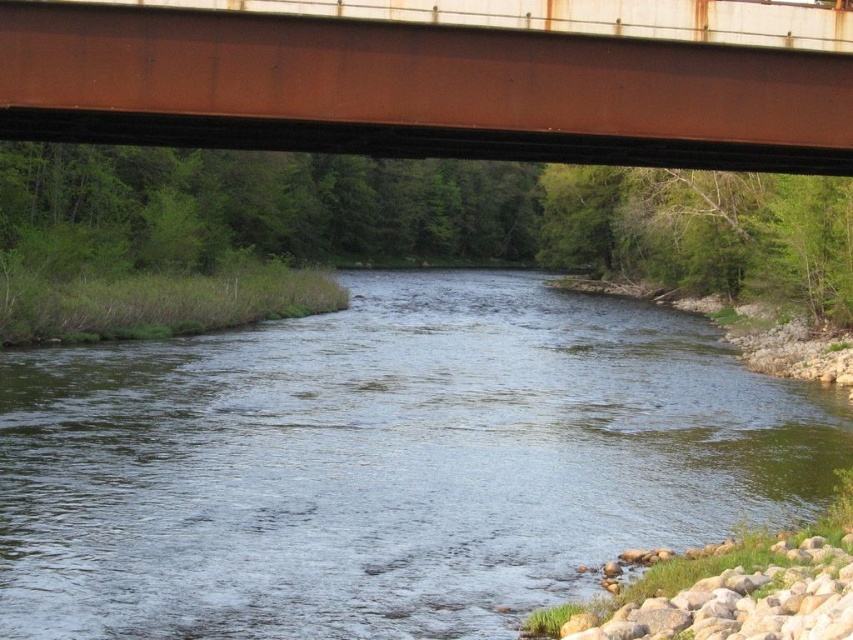
Is point (447, 355) closer to viewer compared to point (701, 80)?

No, it is behind (701, 80).

Is point (482, 474) positioned after point (311, 120)?

Yes, it is.

Where is `clear water at center`? Image resolution: width=853 pixels, height=640 pixels. clear water at center is located at coordinates (386, 464).